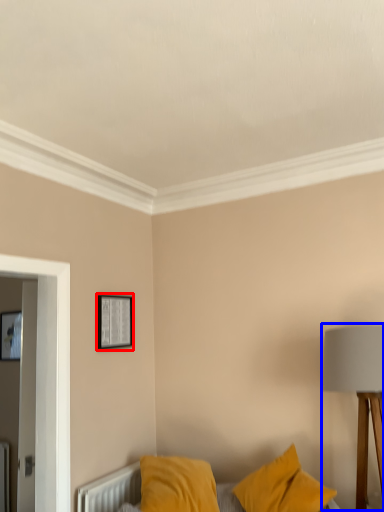
Question: Which point is further to the camera, picture frame (highlighted by a red box) or table lamp (highlighted by a blue box)?

Choices:
 (A) picture frame
 (B) table lamp

Answer: (A)